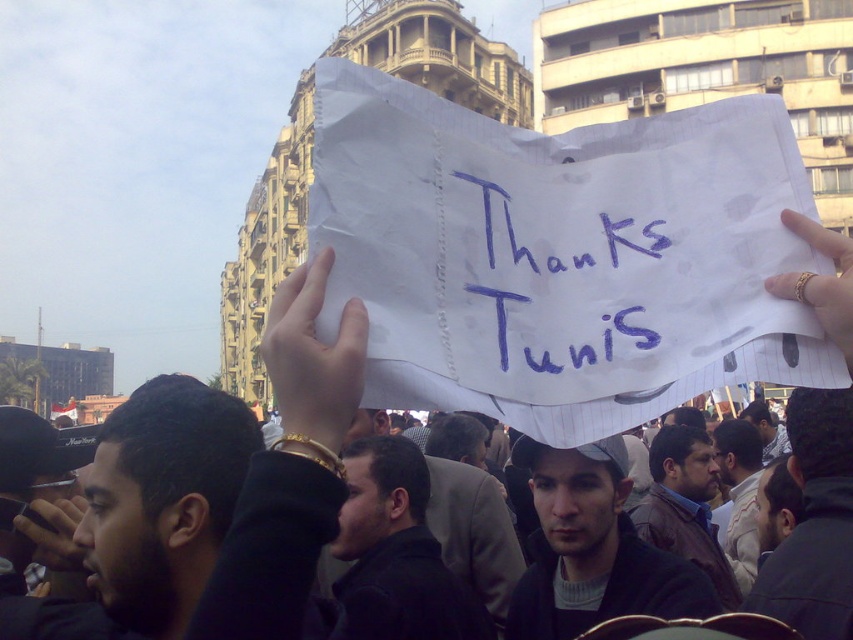
Question: Which object is the farthest from the white paper at center?

Choices:
 (A) matte black camera at lower left
 (B) gold ring at upper right
 (C) blue handwritten sign at center

Answer: (A)

Question: Does dark gray jacket at center have a greater width compared to gold ring at upper right?

Choices:
 (A) no
 (B) yes

Answer: (B)

Question: Is white paper at center smaller than brown leather jacket at center?

Choices:
 (A) yes
 (B) no

Answer: (A)

Question: Which is nearer to the white lined paper at center?

Choices:
 (A) matte black camera at lower left
 (B) dark gray cap at center
 (C) gold ring at upper right

Answer: (C)

Question: Estimate the real-world distances between objects in this image. Which object is closer to the white paper at center?

Choices:
 (A) gold ring at upper right
 (B) brown leather jacket at center
 (C) white lined paper at center
 (D) dark gray cap at center

Answer: (C)

Question: Does dark gray jacket at center appear over gold ring at upper right?

Choices:
 (A) no
 (B) yes

Answer: (A)